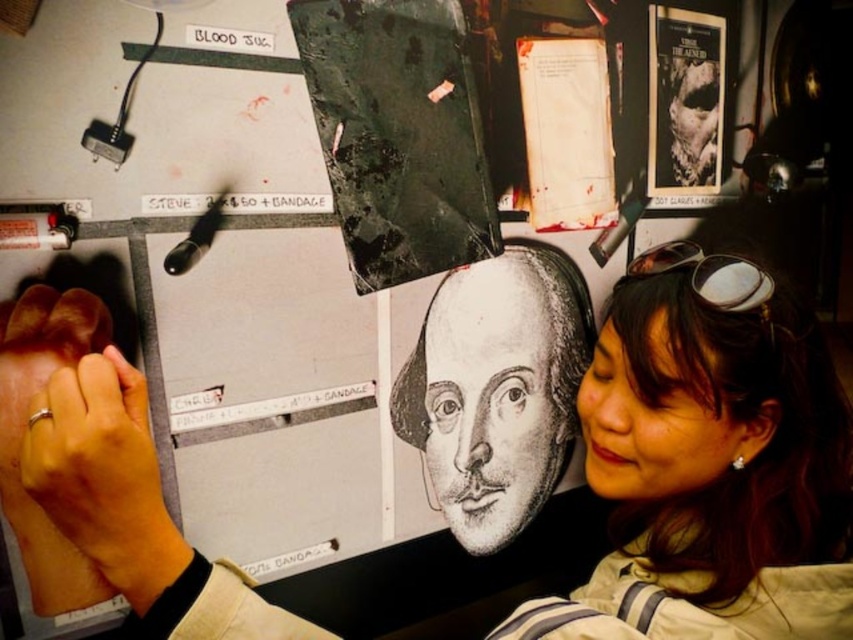
Is matte black face at center smaller than white paper at upper right?

No, matte black face at center is not smaller than white paper at upper right.

Can you confirm if matte black face at center is bigger than white paper at upper right?

Correct, matte black face at center is larger in size than white paper at upper right.

Does point (792, 419) come farther from viewer compared to point (573, 116)?

No, it is not.

Where is `matte black face at center`? The height and width of the screenshot is (640, 853). matte black face at center is located at coordinates (711, 464).

Which of these two, smooth skin face at lower right or hardcover book at upper right, stands shorter?

smooth skin face at lower right

Can you confirm if smooth skin face at lower right is wider than hardcover book at upper right?

No, smooth skin face at lower right is not wider than hardcover book at upper right.

Is point (706, 477) farther from camera compared to point (703, 65)?

That is False.

The height and width of the screenshot is (640, 853). In order to click on smooth skin face at lower right in this screenshot , I will do `click(654, 422)`.

Does smooth skin face at lower right have a greater height compared to white paper at upper right?

No.

From the picture: Does smooth skin face at lower right come behind white paper at upper right?

No.

Is point (683, 413) more distant than point (578, 93)?

That is False.

Image resolution: width=853 pixels, height=640 pixels. In order to click on smooth skin face at lower right in this screenshot , I will do `click(654, 422)`.